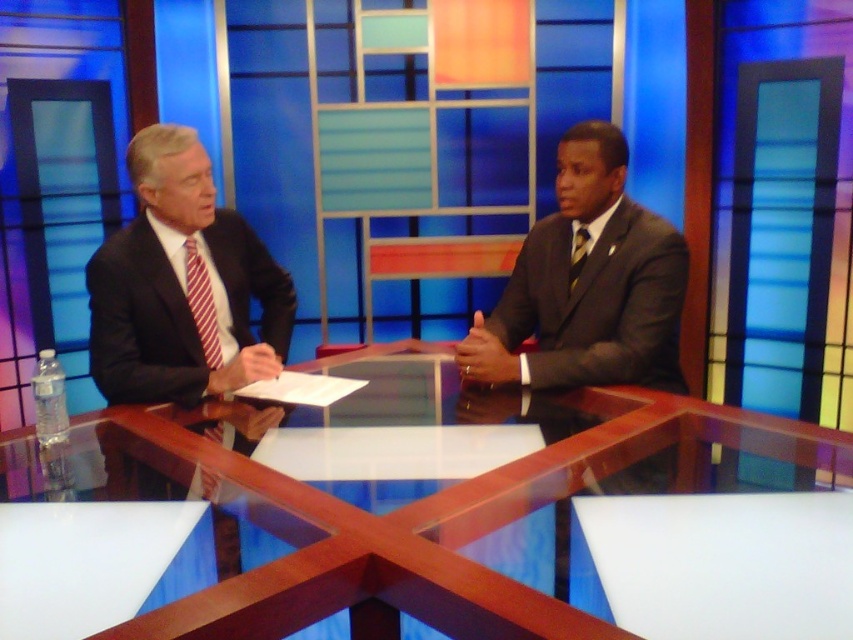
Who is more distant from viewer, (679, 440) or (206, 296)?

Point (206, 296)

Can you confirm if wooden glossy table at center is positioned above red striped tie at left?

Actually, wooden glossy table at center is below red striped tie at left.

Image resolution: width=853 pixels, height=640 pixels. What are the coordinates of `wooden glossy table at center` in the screenshot? It's located at (424, 520).

Does point (526, 588) lie in front of point (541, 305)?

Yes, it is.

Does wooden glossy table at center appear on the left side of matte black suit at right?

Yes, wooden glossy table at center is to the left of matte black suit at right.

Measure the distance between point (714, 612) and camera.

A distance of 3.44 feet exists between point (714, 612) and camera.

The height and width of the screenshot is (640, 853). Find the location of `wooden glossy table at center`. wooden glossy table at center is located at coordinates (424, 520).

Which is above, matte black suit at left or red striped tie at left?

matte black suit at left is higher up.

How distant is matte black suit at left from red striped tie at left?

A distance of 4.92 inches exists between matte black suit at left and red striped tie at left.

This screenshot has width=853, height=640. In order to click on matte black suit at left in this screenshot , I will do `click(183, 285)`.